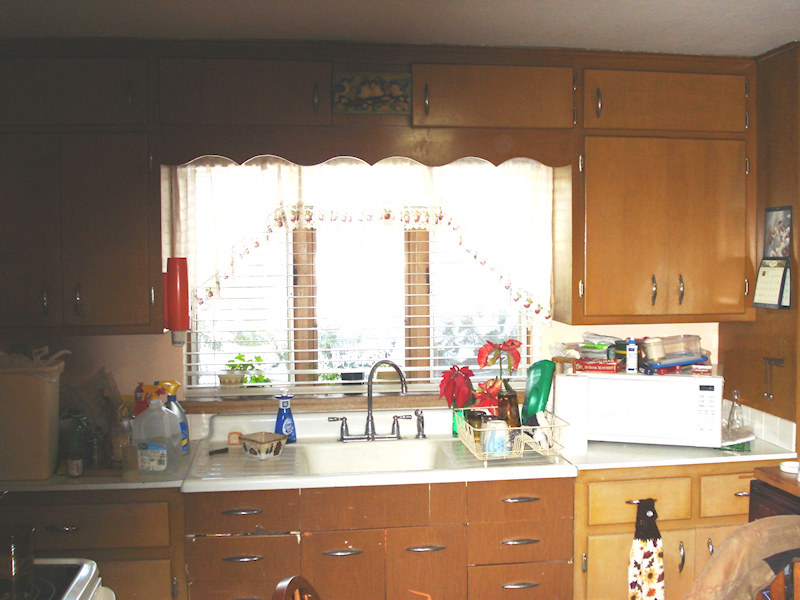
You are a GUI agent. You are given a task and a screenshot of the screen. Output one action in this format:
    pyautogui.click(x=<x>, y=<y>)
    Task: Click on the clear storage container
    This screenshot has width=800, height=600.
    Given the screenshot: What is the action you would take?
    pyautogui.click(x=684, y=353)